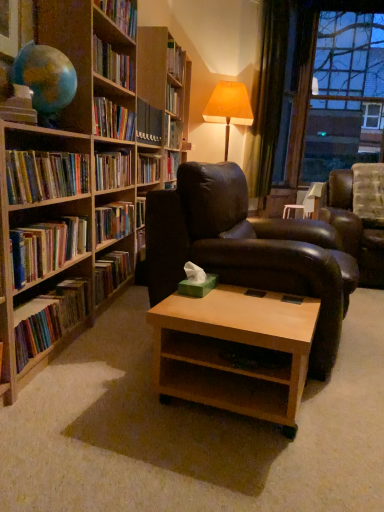
Locate an element on the screen. free spot in front of leather armchair at center is located at coordinates (227, 431).